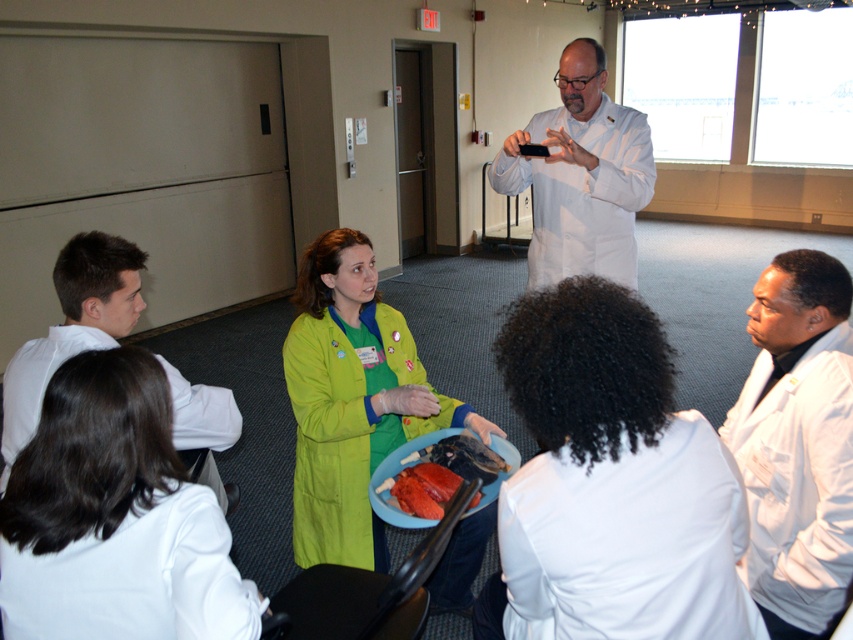
You are a medical student who needs to place a new specimen on the table. The shiny red meat at center is currently occupying space. Can the white matte coat at lower right be moved to make room?

The white matte coat at lower right is bigger than the shiny red meat at center. Moving the white matte coat at lower right would require more space, so it might not be the best option to free up space for the new specimen.

You are a medical student who needs to place a 10 cm wide tool on the table. The table has the white matte coat at lower right and the shiny red meat at center. Which object can you place the tool next to without exceeding its width?

The white matte coat at lower right has a larger width than the shiny red meat at center, so you can place the 10 cm wide tool next to the white matte coat at lower right.